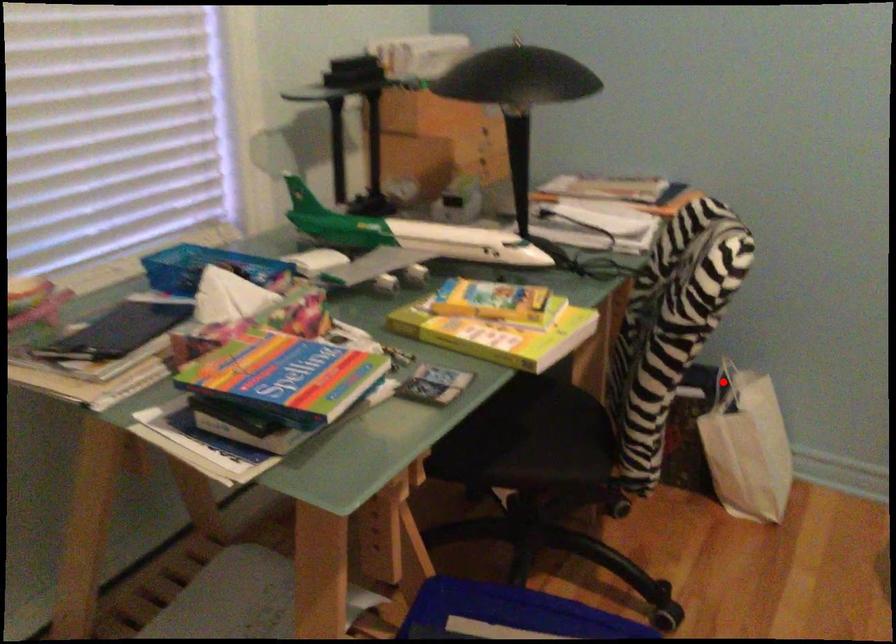
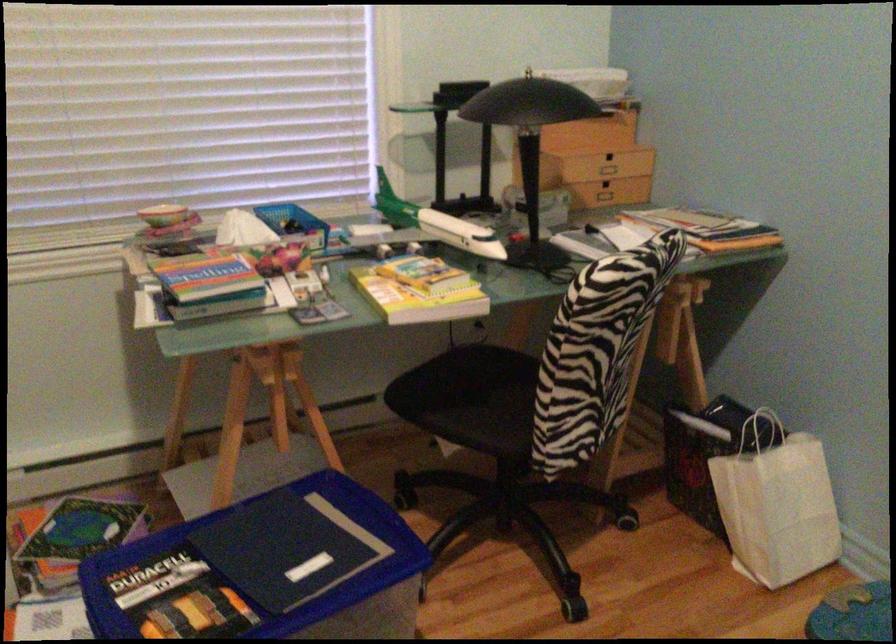
In the second image, find the point that corresponds to the highlighted location in the first image.

(761, 431)